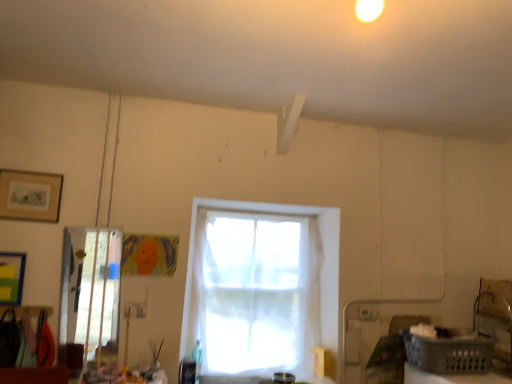
Question: Is gray plastic basket at lower right touching matte black picture frame at upper left?

Choices:
 (A) yes
 (B) no

Answer: (B)

Question: Does gray plastic basket at lower right have a lesser height compared to matte black picture frame at upper left?

Choices:
 (A) yes
 (B) no

Answer: (A)

Question: Does gray plastic basket at lower right lie behind matte black picture frame at upper left?

Choices:
 (A) no
 (B) yes

Answer: (A)

Question: Can we say gray plastic basket at lower right lies outside matte black picture frame at upper left?

Choices:
 (A) yes
 (B) no

Answer: (A)

Question: Considering the relative sizes of gray plastic basket at lower right and matte black picture frame at upper left in the image provided, is gray plastic basket at lower right thinner than matte black picture frame at upper left?

Choices:
 (A) no
 (B) yes

Answer: (A)

Question: Choose the correct answer: Is white sheer curtain at center inside gray plastic basket at lower right or outside it?

Choices:
 (A) inside
 (B) outside

Answer: (B)

Question: Relative to gray plastic basket at lower right, is white sheer curtain at center in front or behind?

Choices:
 (A) behind
 (B) front

Answer: (A)

Question: Based on their positions, is white sheer curtain at center located to the left or right of gray plastic basket at lower right?

Choices:
 (A) left
 (B) right

Answer: (A)

Question: Does point (320, 271) appear closer or farther from the camera than point (434, 360)?

Choices:
 (A) closer
 (B) farther

Answer: (B)

Question: Considering the positions of matte black picture frame at upper left and gray plastic basket at lower right in the image, is matte black picture frame at upper left bigger or smaller than gray plastic basket at lower right?

Choices:
 (A) big
 (B) small

Answer: (B)

Question: In the image, is matte black picture frame at upper left on the left side or the right side of gray plastic basket at lower right?

Choices:
 (A) left
 (B) right

Answer: (A)

Question: From the image's perspective, is matte black picture frame at upper left positioned above or below gray plastic basket at lower right?

Choices:
 (A) below
 (B) above

Answer: (B)

Question: Is matte black picture frame at upper left inside the boundaries of gray plastic basket at lower right, or outside?

Choices:
 (A) inside
 (B) outside

Answer: (B)

Question: From a real-world perspective, relative to clear glass door at left, is matte black picture frame at upper left vertically above or below?

Choices:
 (A) above
 (B) below

Answer: (A)

Question: Considering the relative positions of matte black picture frame at upper left and clear glass door at left in the image provided, is matte black picture frame at upper left to the left or to the right of clear glass door at left?

Choices:
 (A) right
 (B) left

Answer: (B)